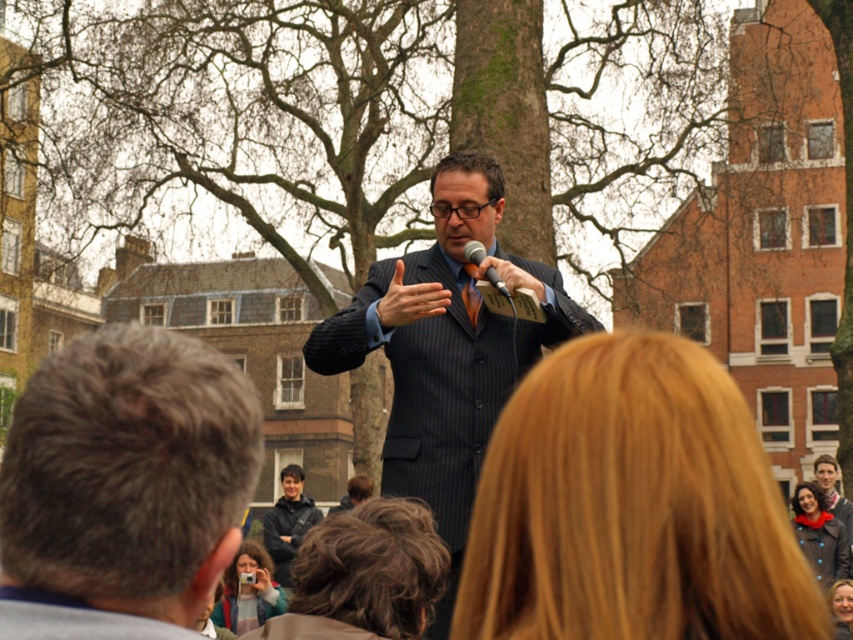
Question: Which of the following is the farthest from the observer?

Choices:
 (A) dark brown hair at center
 (B) dark blue jacket at center
 (C) dark pinstripe suit at center

Answer: (B)

Question: Which object is positioned farthest from the red woolen scarf at lower right?

Choices:
 (A) smooth brown hair at center
 (B) matte pink jacket at lower center
 (C) gray hair at center
 (D) dark brown hair at center

Answer: (C)

Question: Considering the relative positions of gray hair at center and dark blue jacket at center in the image provided, where is gray hair at center located with respect to dark blue jacket at center?

Choices:
 (A) left
 (B) right

Answer: (A)

Question: Which object is closer to the camera taking this photo?

Choices:
 (A) red woolen scarf at lower right
 (B) matte pink jacket at lower center
 (C) dark brown hair at center
 (D) gray hair at center

Answer: (D)

Question: Is the position of red woolen scarf at lower right more distant than that of dark blue jacket at center?

Choices:
 (A) no
 (B) yes

Answer: (A)

Question: Observing the image, what is the correct spatial positioning of gray hair at center in reference to dark pinstripe suit at center?

Choices:
 (A) below
 (B) above

Answer: (A)